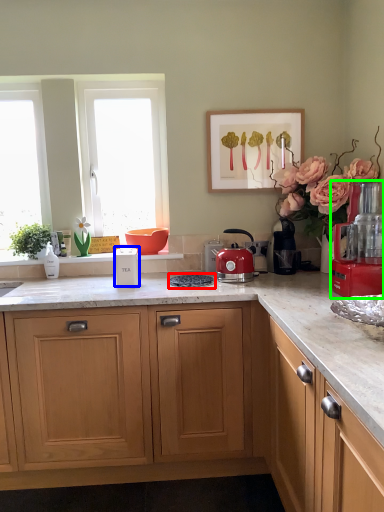
Question: Which object is the farthest from gas stove (highlighted by a red box)? Choose among these: kitchen appliance (highlighted by a blue box) or kitchen appliance (highlighted by a green box).

Choices:
 (A) kitchen appliance
 (B) kitchen appliance

Answer: (B)